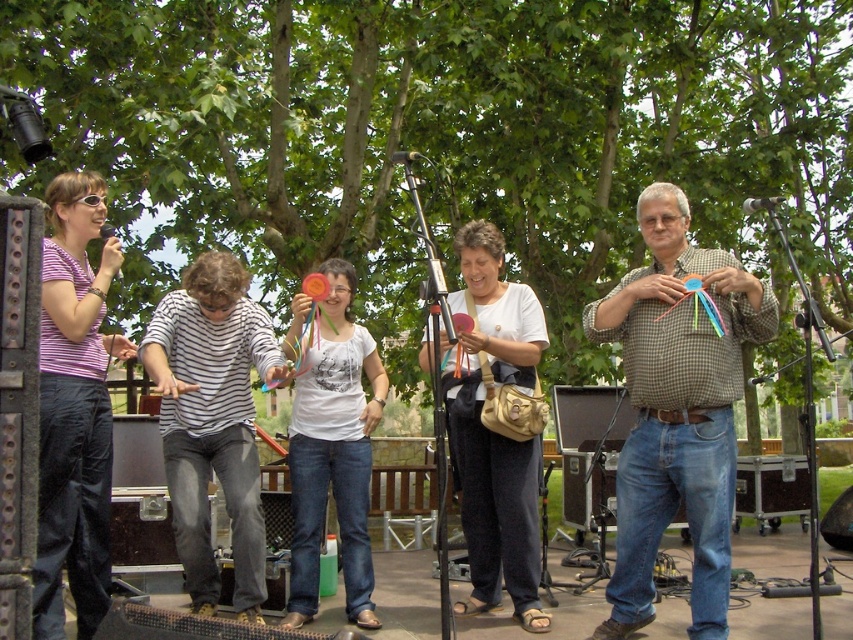
Question: Among these objects, which one is farthest from the camera?

Choices:
 (A) checkered shirt at center
 (B) striped shirt at center

Answer: (B)

Question: Can you confirm if striped shirt at center is positioned below matte purple shirt at center?

Choices:
 (A) yes
 (B) no

Answer: (A)

Question: Estimate the real-world distances between objects in this image. Which object is closer to the matte purple shirt at center?

Choices:
 (A) striped shirt at center
 (B) white fabric purse at center
 (C) checkered shirt at center

Answer: (A)

Question: Is matte purple shirt at center to the left of white matte shirt at center from the viewer's perspective?

Choices:
 (A) yes
 (B) no

Answer: (A)

Question: Which is farther from the checkered shirt at center?

Choices:
 (A) matte purple shirt at center
 (B) striped shirt at center

Answer: (A)

Question: Is checkered shirt at center wider than white fabric purse at center?

Choices:
 (A) yes
 (B) no

Answer: (A)